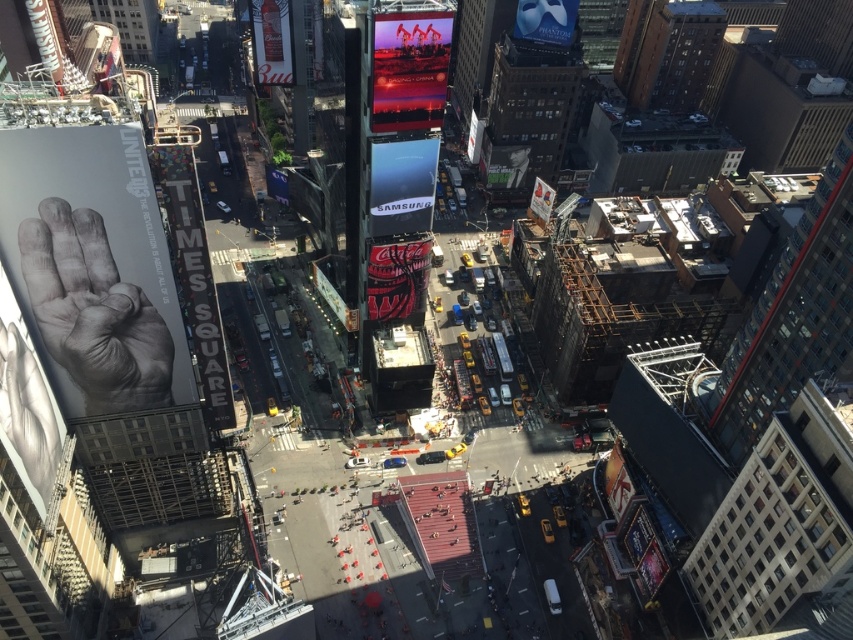
Does black matte hand at upper left appear over metallic silver budweiser sign at upper left?

No, black matte hand at upper left is not above metallic silver budweiser sign at upper left.

Is black matte hand at upper left positioned at the back of metallic silver budweiser sign at upper left?

No, it is in front of metallic silver budweiser sign at upper left.

Who is more forward, (163, 253) or (257, 52)?

Point (163, 253) is more forward.

Find the location of a particular element. This screenshot has width=853, height=640. black matte hand at upper left is located at coordinates (91, 268).

Does white paper times square sign at left have a lesser width compared to shiny red coca-cola sign at center?

Yes, white paper times square sign at left is thinner than shiny red coca-cola sign at center.

Does point (207, 266) lie behind point (419, 291)?

That is False.

What do you see at coordinates (192, 273) in the screenshot? This screenshot has width=853, height=640. I see `white paper times square sign at left` at bounding box center [192, 273].

This screenshot has height=640, width=853. What are the coordinates of `white paper times square sign at left` in the screenshot? It's located at (192, 273).

Is white paper times square sign at left wider than matte white mask at upper center?

Incorrect, white paper times square sign at left's width does not surpass matte white mask at upper center's.

Is white paper times square sign at left to the right of matte white mask at upper center from the viewer's perspective?

Incorrect, white paper times square sign at left is not on the right side of matte white mask at upper center.

You are a GUI agent. You are given a task and a screenshot of the screen. Output one action in this format:
    pyautogui.click(x=<x>, y=<y>)
    Task: Click on the white paper times square sign at left
    Image resolution: width=853 pixels, height=640 pixels.
    Given the screenshot: What is the action you would take?
    pyautogui.click(x=192, y=273)